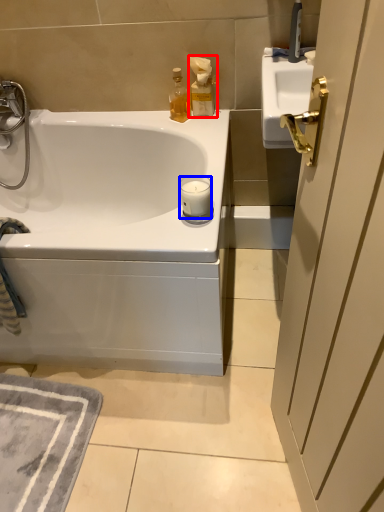
Question: Which object appears closest to the camera in this image, bottle (highlighted by a red box) or candle (highlighted by a blue box)?

Choices:
 (A) bottle
 (B) candle

Answer: (B)